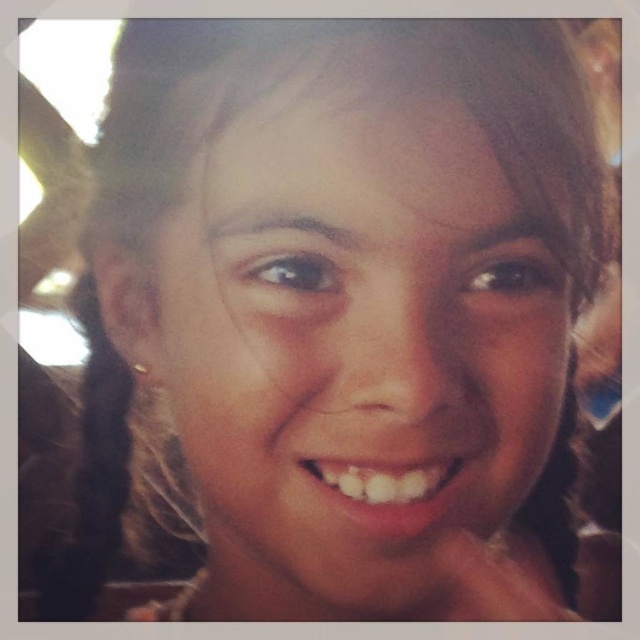
Question: Which object is positioned closest to the white glossy teeth at center?

Choices:
 (A) black hair at left
 (B) smooth skin face at center

Answer: (B)

Question: Which point is closer to the camera taking this photo?

Choices:
 (A) (120, 387)
 (B) (192, 284)

Answer: (B)

Question: Which point appears closest to the camera in this image?

Choices:
 (A) (170, 374)
 (B) (330, 490)

Answer: (B)

Question: Observing the image, what is the correct spatial positioning of smooth skin face at center in reference to black hair at left?

Choices:
 (A) above
 (B) below

Answer: (A)

Question: Where is smooth skin face at center located in relation to black hair at left in the image?

Choices:
 (A) left
 (B) right

Answer: (B)

Question: Does smooth skin face at center lie behind white glossy teeth at center?

Choices:
 (A) yes
 (B) no

Answer: (B)